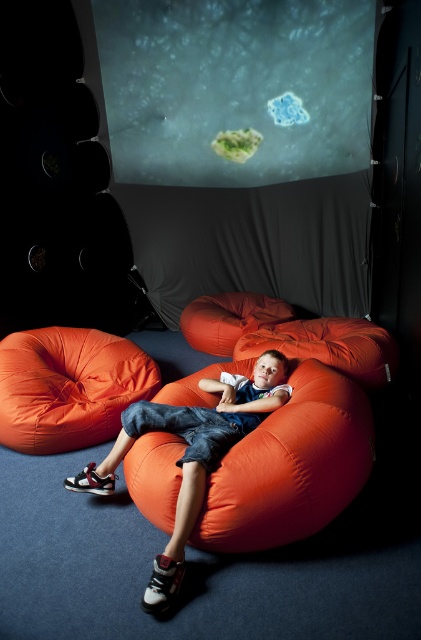
Question: Which object is farther from the camera taking this photo?

Choices:
 (A) orange fabric bean bag at center
 (B) orange fabric bean bag at lower left

Answer: (B)

Question: Which point appears closest to the camera in this image?

Choices:
 (A) (277, 353)
 (B) (368, 467)

Answer: (B)

Question: Is orange fabric bean bag at lower left wider than matte orange beanbag at center?

Choices:
 (A) no
 (B) yes

Answer: (A)

Question: Which is nearer to the orange fabric bean bag at lower left?

Choices:
 (A) matte orange beanbag at center
 (B) orange fabric bean bag at center

Answer: (A)

Question: Can you confirm if orange fabric bean bag at center is wider than matte orange beanbag at center?

Choices:
 (A) yes
 (B) no

Answer: (A)

Question: Can you confirm if orange fabric bean bag at center is positioned below matte orange beanbag at center?

Choices:
 (A) yes
 (B) no

Answer: (B)